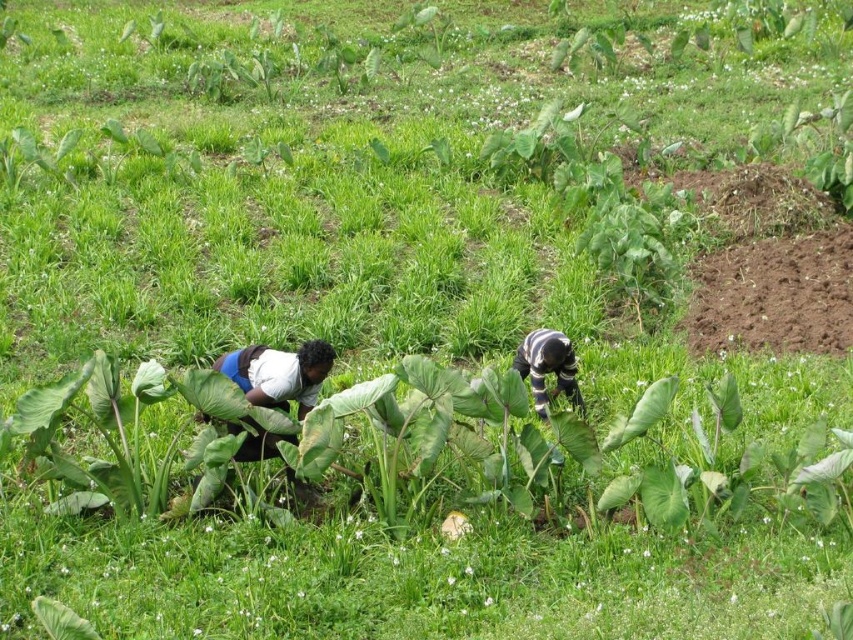
Does white cotton shirt at lower left appear under striped fabric person at center?

Correct, white cotton shirt at lower left is located below striped fabric person at center.

Which is more to the right, white cotton shirt at lower left or striped fabric person at center?

From the viewer's perspective, striped fabric person at center appears more on the right side.

Between point (300, 388) and point (518, 360), which one is positioned behind?

Positioned behind is point (518, 360).

Locate an element on the screen. The width and height of the screenshot is (853, 640). white cotton shirt at lower left is located at coordinates (277, 372).